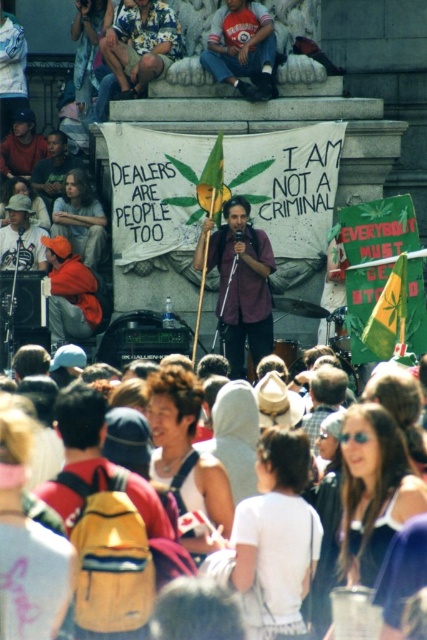
You are a photographer at the protest and need to capture a clear shot of both the white cotton hoodie at center and the denim jeans at upper center. Which object should you focus on first to ensure proper focus, considering their height?

The white cotton hoodie at center is much taller than the denim jeans at upper center, so you should focus on the white cotton hoodie at center first to ensure proper focus.

You are a photographer trying to capture a clear shot of the matte purple shirt at center and the denim jeans at upper center. Based on their sizes, which one would appear smaller in your photo?

The matte purple shirt at center appears smaller in the photo because its width is less than the denim jeans at upper center.